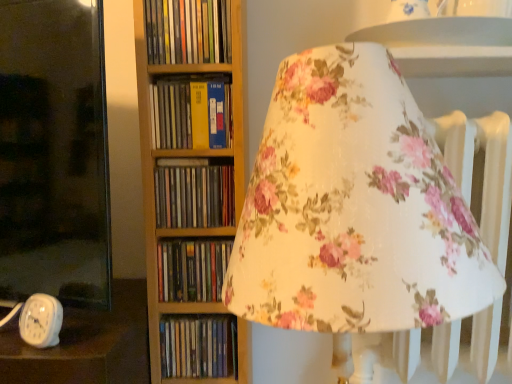
Question: Which direction should I rotate to face brown cardboard book at center, placed as the third book when sorted from bottom to top, — up or down?

Choices:
 (A) up
 (B) down

Answer: (B)

Question: Is matte black book at center, which ranks as the 2th book in bottom-to-top order, at the left side of yellow matte book at center, placed as the fourth book when sorted from bottom to top?

Choices:
 (A) yes
 (B) no

Answer: (B)

Question: Is yellow matte book at center, placed as the fourth book when sorted from bottom to top, at the back of matte black book at center, which ranks as the 2th book in bottom-to-top order?

Choices:
 (A) yes
 (B) no

Answer: (B)

Question: Can you confirm if matte black book at center, positioned as the fourth book in top-to-bottom order, is shorter than yellow matte book at center, which is the 2th book in top-to-bottom order?

Choices:
 (A) yes
 (B) no

Answer: (A)

Question: Can you confirm if matte black book at center, which ranks as the 2th book in bottom-to-top order, is smaller than yellow matte book at center, placed as the fourth book when sorted from bottom to top?

Choices:
 (A) no
 (B) yes

Answer: (B)

Question: Is matte black book at center, positioned as the fourth book in top-to-bottom order, taller than yellow matte book at center, placed as the fourth book when sorted from bottom to top?

Choices:
 (A) yes
 (B) no

Answer: (B)

Question: From a real-world perspective, is matte black book at center, positioned as the fourth book in top-to-bottom order, under yellow matte book at center, placed as the fourth book when sorted from bottom to top?

Choices:
 (A) no
 (B) yes

Answer: (B)

Question: From the image's perspective, does matte black book at center, positioned as the fourth book in top-to-bottom order, appear lower than hardcover books at center, marked as the first book in a top-to-bottom arrangement?

Choices:
 (A) yes
 (B) no

Answer: (A)

Question: Considering the relative sizes of matte black book at center, which ranks as the 2th book in bottom-to-top order, and hardcover books at center, placed as the fifth book when sorted from bottom to top, in the image provided, is matte black book at center, which ranks as the 2th book in bottom-to-top order, smaller than hardcover books at center, placed as the fifth book when sorted from bottom to top,?

Choices:
 (A) yes
 (B) no

Answer: (A)

Question: Is matte black book at center, which ranks as the 2th book in bottom-to-top order, shorter than hardcover books at center, placed as the fifth book when sorted from bottom to top?

Choices:
 (A) yes
 (B) no

Answer: (A)

Question: Is matte black book at center, which ranks as the 2th book in bottom-to-top order, to the right of hardcover books at center, placed as the fifth book when sorted from bottom to top, from the viewer's perspective?

Choices:
 (A) yes
 (B) no

Answer: (A)

Question: From the image's perspective, is matte black book at center, which ranks as the 2th book in bottom-to-top order, on top of hardcover books at center, marked as the first book in a top-to-bottom arrangement?

Choices:
 (A) no
 (B) yes

Answer: (A)

Question: From a real-world perspective, is matte black book at center, which ranks as the 2th book in bottom-to-top order, positioned under hardcover books at center, marked as the first book in a top-to-bottom arrangement, based on gravity?

Choices:
 (A) no
 (B) yes

Answer: (B)

Question: Can you confirm if hardcover books at center, marked as the first book in a top-to-bottom arrangement, is taller than matte plastic books at center, placed as the fifth book when sorted from top to bottom?

Choices:
 (A) no
 (B) yes

Answer: (B)